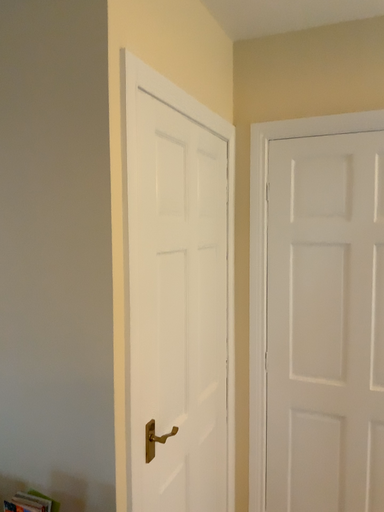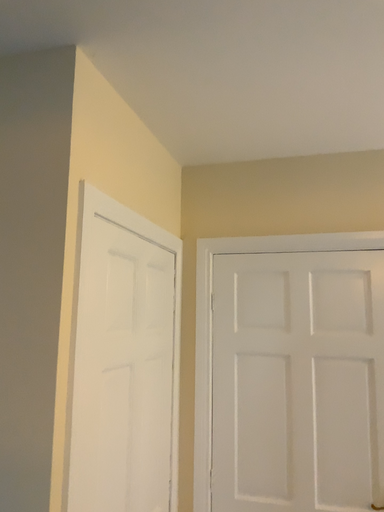
Question: How did the camera likely rotate when shooting the video?

Choices:
 (A) rotated right
 (B) rotated left

Answer: (A)